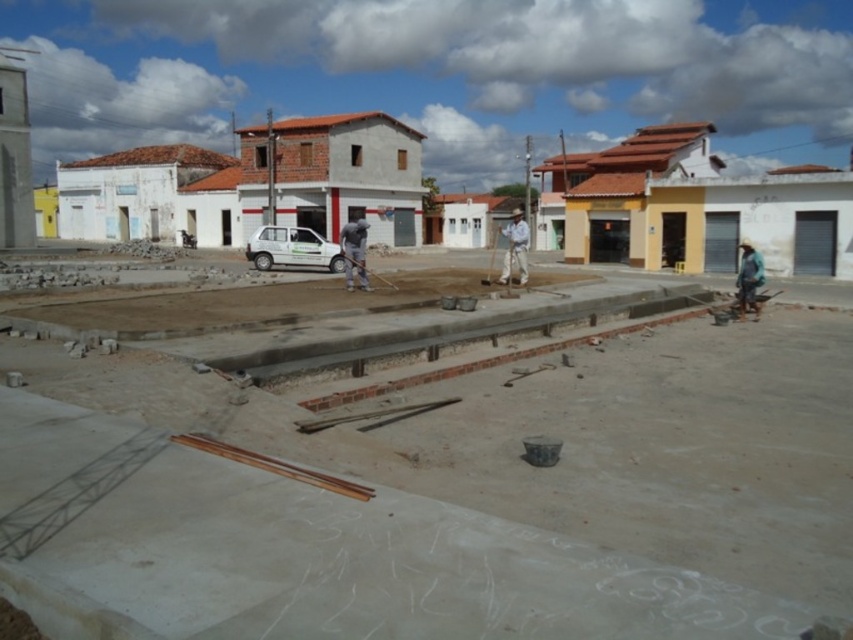
You are a delivery person with a cart that requires a minimum of 8 meters of space to maneuver. You need to move from the smooth concrete surface at center to the white cotton shirt at center. Is there enough space to navigate your cart between these two points?

The distance between the smooth concrete surface at center and the white cotton shirt at center is 9.54 meters, which is more than the required 8 meters. Therefore, there is sufficient space to maneuver the cart between these two points.

You are a delivery person trying to reach the gray matte shirt at center who is working on the construction site. The smooth concrete surface at center is in your way. Can you walk around it to get to them?

The smooth concrete surface at center is in front of the gray matte shirt at center, so you can walk around it to reach them since it is blocking the direct path but allows for detour.

You are a construction worker at the site and you need to find a shirt to wear. You see the gray matte shirt at center and the white cotton shirt at center. Which shirt is located lower in the image?

The gray matte shirt at center is below the white cotton shirt at center, so the gray matte shirt at center is located lower in the image.